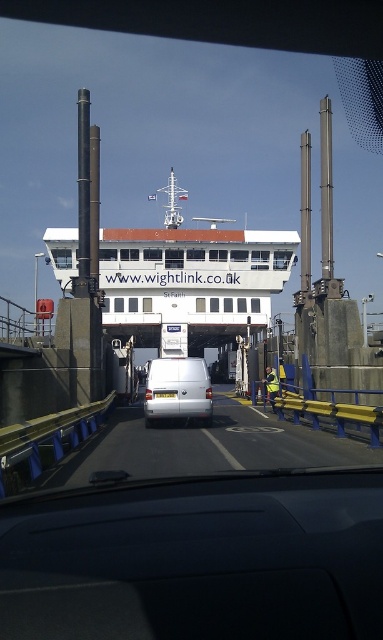
Question: Which point is closer to the camera?

Choices:
 (A) white matte van at center
 (B) white matte ferry at center

Answer: (A)

Question: Can you confirm if white matte ferry at center is thinner than white matte van at center?

Choices:
 (A) no
 (B) yes

Answer: (A)

Question: Does white matte ferry at center appear over white matte van at center?

Choices:
 (A) yes
 (B) no

Answer: (A)

Question: Which of the following is the closest to the observer?

Choices:
 (A) white matte van at center
 (B) white matte ferry at center

Answer: (A)

Question: Can you confirm if white matte ferry at center is positioned to the left of white matte van at center?

Choices:
 (A) yes
 (B) no

Answer: (A)